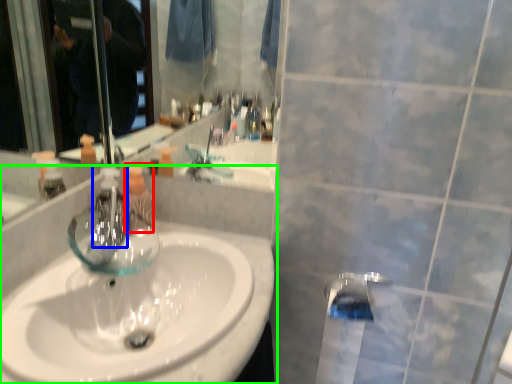
Question: Which is nearer to the mouthwash (highlighted by a red box)? faucet (highlighted by a blue box) or sink (highlighted by a green box).

Choices:
 (A) faucet
 (B) sink

Answer: (A)